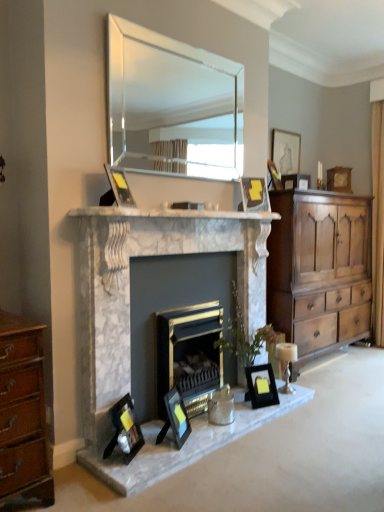
Where is `black matte picture frame at lower center, marked as the fifth picture frame in a back-to-front arrangement`? This screenshot has height=512, width=384. black matte picture frame at lower center, marked as the fifth picture frame in a back-to-front arrangement is located at coordinates (257, 387).

In order to face matte black picture frame at upper center, marked as the 5th picture frame in a bottom-to-top arrangement, should I rotate leftwards or rightwards?

To face it directly, rotate right by 8.531 degrees.

Where is `wooden chest of drawers at right`? The width and height of the screenshot is (384, 512). wooden chest of drawers at right is located at coordinates (320, 270).

What do you see at coordinates (175, 418) in the screenshot? The image size is (384, 512). I see `matte black picture frame at center, placed as the 2th picture frame when sorted from bottom to top` at bounding box center [175, 418].

Locate an element on the screen. This screenshot has height=512, width=384. matte black picture frame at center, marked as the 3th picture frame in a left-to-right arrangement is located at coordinates (175, 418).

At what (x,y) coordinates should I click in order to perform the action: click on black matte picture frame at lower center, arranged as the sixth picture frame when viewed from the top. Please return your answer as a coordinate pair (x, y). The image size is (384, 512). Looking at the image, I should click on (257, 387).

From the image's perspective, who appears lower, matte black picture frame at upper center, arranged as the 3th picture frame when viewed from the right, or white marble fireplace at center?

white marble fireplace at center, from the image's perspective.

Between matte black picture frame at upper center, arranged as the 3th picture frame when viewed from the right, and white marble fireplace at center, which one has smaller size?

matte black picture frame at upper center, arranged as the 3th picture frame when viewed from the right, is smaller.

Is point (267, 161) closer or farther from the camera than point (190, 214)?

Point (267, 161) appears to be farther away from the viewer than point (190, 214).

Is matte black picture frame at upper center, arranged as the 3th picture frame when viewed from the right, positioned in front of white marble fireplace at center?

No, matte black picture frame at upper center, arranged as the 3th picture frame when viewed from the right, is further to the viewer.

Can you tell me how much wooden picture frame at upper right, which ranks as the second picture frame in top-to-bottom order, and matte black picture frame at lower left, which is the eighth picture frame in back-to-front order, differ in facing direction?

The angular difference between wooden picture frame at upper right, which ranks as the second picture frame in top-to-bottom order, and matte black picture frame at lower left, which is the eighth picture frame in back-to-front order, is 74.9 degrees.

From a real-world perspective, is wooden picture frame at upper right, acting as the first picture frame starting from the right, on matte black picture frame at lower left, acting as the second picture frame starting from the left?

Yes, from a real-world perspective, wooden picture frame at upper right, acting as the first picture frame starting from the right, is over matte black picture frame at lower left, acting as the second picture frame starting from the left

From the image's perspective, which one is positioned lower, wooden picture frame at upper right, acting as the 1th picture frame starting from the back, or matte black picture frame at lower left, the 1th picture frame when ordered from bottom to top?

matte black picture frame at lower left, the 1th picture frame when ordered from bottom to top, appears lower in the image.

At what (x,y) coordinates should I click in order to perform the action: click on the 7th picture frame in front of the wooden picture frame at upper right, acting as the 7th picture frame starting from the bottom, counting from the anchor's position. Please return your answer as a coordinate pair (x, y). The width and height of the screenshot is (384, 512). Looking at the image, I should click on (125, 430).

Does matte black picture frame at upper center, which ranks as the fifth picture frame in right-to-left order, appear on the left side of matte wooden picture frame at upper right, which ranks as the eighth picture frame in bottom-to-top order?

Correct, you'll find matte black picture frame at upper center, which ranks as the fifth picture frame in right-to-left order, to the left of matte wooden picture frame at upper right, which ranks as the eighth picture frame in bottom-to-top order.

From a real-world perspective, is matte black picture frame at upper center, marked as the 5th picture frame in a front-to-back arrangement, above or below matte wooden picture frame at upper right, which is the second picture frame from right to left?

matte black picture frame at upper center, marked as the 5th picture frame in a front-to-back arrangement, is situated lower than matte wooden picture frame at upper right, which is the second picture frame from right to left, in the real world.

Considering the positions of points (260, 182) and (299, 147), is point (260, 182) farther from camera compared to point (299, 147)?

No, (260, 182) is in front of (299, 147).

Is matte wooden picture frame at upper right, which is counted as the 7th picture frame, starting from the left, at the back of matte black picture frame at upper center, marked as the 5th picture frame in a bottom-to-top arrangement?

No, matte black picture frame at upper center, marked as the 5th picture frame in a bottom-to-top arrangement,'s orientation is not away from matte wooden picture frame at upper right, which is counted as the 7th picture frame, starting from the left.

Could you tell me if marble fireplace at center, the 2th fireplace when ordered from right to left, is turned towards wooden chest of drawers at right?

No, marble fireplace at center, the 2th fireplace when ordered from right to left, is not turned towards wooden chest of drawers at right.

Is marble fireplace at center, which is the first fireplace in left-to-right order, positioned behind wooden chest of drawers at right?

No, marble fireplace at center, which is the first fireplace in left-to-right order, is closer to the camera.

From the image's perspective, relative to wooden chest of drawers at right, is marble fireplace at center, the 2th fireplace when ordered from right to left, above or below?

marble fireplace at center, the 2th fireplace when ordered from right to left, is situated lower than wooden chest of drawers at right in the image.

Find the location of a particular element. the 2nd fireplace to the left of the wooden chest of drawers at right, counting from the anchor's position is located at coordinates (130, 332).

In the image, is wooden chest of drawers at right on the left side or the right side of marble fireplace at center, which is the first fireplace in left-to-right order?

In the image, wooden chest of drawers at right appears on the right side of marble fireplace at center, which is the first fireplace in left-to-right order.

In the scene shown: From a real-world perspective, does wooden chest of drawers at right sit lower than marble fireplace at center, the 2th fireplace when ordered from right to left?

No, from a real-world perspective, wooden chest of drawers at right is not beneath marble fireplace at center, the 2th fireplace when ordered from right to left.

Consider the image. Would you consider wooden chest of drawers at right to be distant from marble fireplace at center, which is the first fireplace in left-to-right order?

They are positioned close to each other.

Measure the distance from wooden chest of drawers at right to marble fireplace at center, which is the first fireplace in left-to-right order.

A distance of 35.02 inches exists between wooden chest of drawers at right and marble fireplace at center, which is the first fireplace in left-to-right order.

Does gold metallic fireplace at center, which ranks as the 1th fireplace in right-to-left order, come behind marble fireplace at center, which is the first fireplace in left-to-right order?

That is True.

Identify the location of fireplace that is on the right side of marble fireplace at center, which is the first fireplace in left-to-right order. (189, 354).

Does gold metallic fireplace at center, which ranks as the 1th fireplace in right-to-left order, have a larger size compared to marble fireplace at center, the 2th fireplace when ordered from right to left?

Incorrect, gold metallic fireplace at center, which ranks as the 1th fireplace in right-to-left order, is not larger than marble fireplace at center, the 2th fireplace when ordered from right to left.

Between gold metallic fireplace at center, the second fireplace when ordered from left to right, and marble fireplace at center, which is the first fireplace in left-to-right order, which one appears on the right side from the viewer's perspective?

Positioned to the right is gold metallic fireplace at center, the second fireplace when ordered from left to right.

Considering the relative sizes of matte black picture frame at lower left, which is the eighth picture frame in back-to-front order, and white marble fireplace at center in the image provided, is matte black picture frame at lower left, which is the eighth picture frame in back-to-front order, smaller than white marble fireplace at center?

Yes.

Is matte black picture frame at lower left, which appears as the seventh picture frame when viewed from the right, not near white marble fireplace at center?

Yes, matte black picture frame at lower left, which appears as the seventh picture frame when viewed from the right, and white marble fireplace at center are located far from each other.

Considering the positions of point (141, 435) and point (279, 216), is point (141, 435) closer or farther from the camera than point (279, 216)?

Point (141, 435).

The image size is (384, 512). Identify the location of mantle on the left of the matte black picture frame at upper center, arranged as the 3th picture frame when viewed from the right. (170, 213).

Identify the location of the 7th picture frame behind the matte black picture frame at lower left, acting as the second picture frame starting from the left, counting from the anchor's position. The width and height of the screenshot is (384, 512). (339, 179).

When comparing their distances from matte black picture frame at center, which is counted as the 6th picture frame, starting from the back, does clear glass mirror at upper center or matte black picture frame at lower left, marked as the 1th picture frame in a front-to-back arrangement, seem closer?

Based on the image, matte black picture frame at lower left, marked as the 1th picture frame in a front-to-back arrangement, appears to be nearer to matte black picture frame at center, which is counted as the 6th picture frame, starting from the back.

Estimate the real-world distances between objects in this image. Which object is further from clear glass mirror at upper center, matte wooden picture frame at upper right, placed as the 1th picture frame when sorted from top to bottom, or black matte picture frame at lower center, placed as the third picture frame when sorted from bottom to top?

black matte picture frame at lower center, placed as the third picture frame when sorted from bottom to top, is positioned further to the anchor clear glass mirror at upper center.

Looking at the image, which one is located closer to black matte picture frame at lower center, the fifth picture frame when ordered from left to right, gold metallic fireplace at center, which ranks as the 1th fireplace in right-to-left order, or wooden picture frame at upper right, marked as the eighth picture frame in a left-to-right arrangement?

Among the two, gold metallic fireplace at center, which ranks as the 1th fireplace in right-to-left order, is located nearer to black matte picture frame at lower center, the fifth picture frame when ordered from left to right.

Considering their positions, is wooden chest of drawers at right positioned further to matte black picture frame at upper center, the sixth picture frame when ordered from bottom to top, than wooden picture frame at upper right, marked as the eighth picture frame in a left-to-right arrangement?

Among the two, wooden chest of drawers at right is located further to matte black picture frame at upper center, the sixth picture frame when ordered from bottom to top.

Considering their positions, is white marble fireplace at center positioned further to marble fireplace at center, which is the first fireplace in left-to-right order, than silver metallic candle holder at center?

silver metallic candle holder at center lies further to marble fireplace at center, which is the first fireplace in left-to-right order, than the other object.

Looking at the image, which one is located closer to matte black picture frame at upper center, which is the fourth picture frame from left to right, silver metallic candle holder at center or gold metallic fireplace at center, which ranks as the 1th fireplace in right-to-left order?

gold metallic fireplace at center, which ranks as the 1th fireplace in right-to-left order.

From the image, which object appears to be nearer to matte black picture frame at center, which is the seventh picture frame in top-to-bottom order, matte black picture frame at lower left, acting as the second picture frame starting from the left, or wooden chest of drawers at right?

matte black picture frame at lower left, acting as the second picture frame starting from the left, is positioned closer to the anchor matte black picture frame at center, which is the seventh picture frame in top-to-bottom order.

When comparing their distances from black matte picture frame at lower center, the fifth picture frame when ordered from left to right, does clear glass mirror at upper center or matte wooden picture frame at upper right, which is the second picture frame from right to left, seem further?

clear glass mirror at upper center is positioned further to the anchor black matte picture frame at lower center, the fifth picture frame when ordered from left to right.

Locate an element on the screen. The height and width of the screenshot is (512, 384). fireplace between matte black picture frame at upper center, marked as the first picture frame in a left-to-right arrangement, and gold metallic fireplace at center, which ranks as the 1th fireplace in right-to-left order, in the vertical direction is located at coordinates (130, 332).

What are the coordinates of `fireplace between white marble fireplace at center and gold metallic fireplace at center, the second fireplace when ordered from left to right, vertically` in the screenshot? It's located at (130, 332).

Find the location of a particular element. mantle that lies between clear glass mirror at upper center and black matte picture frame at lower center, arranged as the sixth picture frame when viewed from the top, from top to bottom is located at coordinates (170, 213).

Identify the location of fireplace between matte black picture frame at upper center, marked as the first picture frame in a left-to-right arrangement, and matte wooden picture frame at upper right, which is the second picture frame from right to left, in the front-back direction. (189, 354).